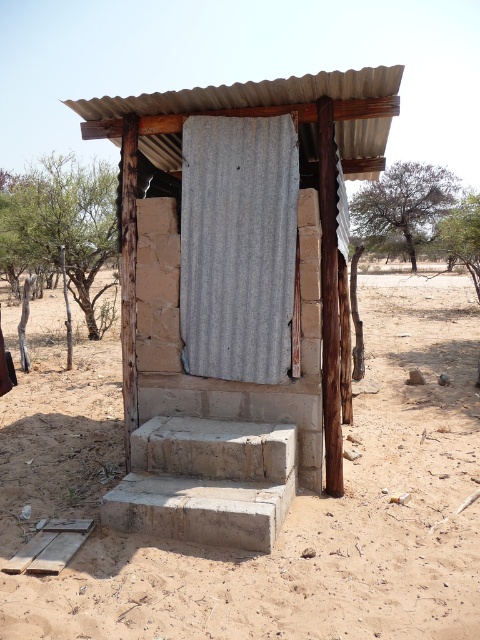
Based on the photo, does corrugated metal hut at center lie behind dull brown dirt at center?

Yes, it is behind dull brown dirt at center.

Describe the element at coordinates (237, 296) in the screenshot. I see `corrugated metal hut at center` at that location.

Find the location of a particular element. corrugated metal hut at center is located at coordinates (237, 296).

Can you confirm if dull brown dirt at center is positioned below gray corrugated metal door at center?

Correct, dull brown dirt at center is located below gray corrugated metal door at center.

This screenshot has width=480, height=640. I want to click on dull brown dirt at center, so click(319, 515).

This screenshot has height=640, width=480. Find the location of `dull brown dirt at center`. dull brown dirt at center is located at coordinates (319, 515).

Find the location of a particular element. corrugated metal hut at center is located at coordinates (237, 296).

Does corrugated metal hut at center appear over gray corrugated metal door at center?

Yes.

Between point (175, 124) and point (288, 234), which one is positioned in front?

Positioned in front is point (288, 234).

This screenshot has height=640, width=480. I want to click on corrugated metal hut at center, so click(x=237, y=296).